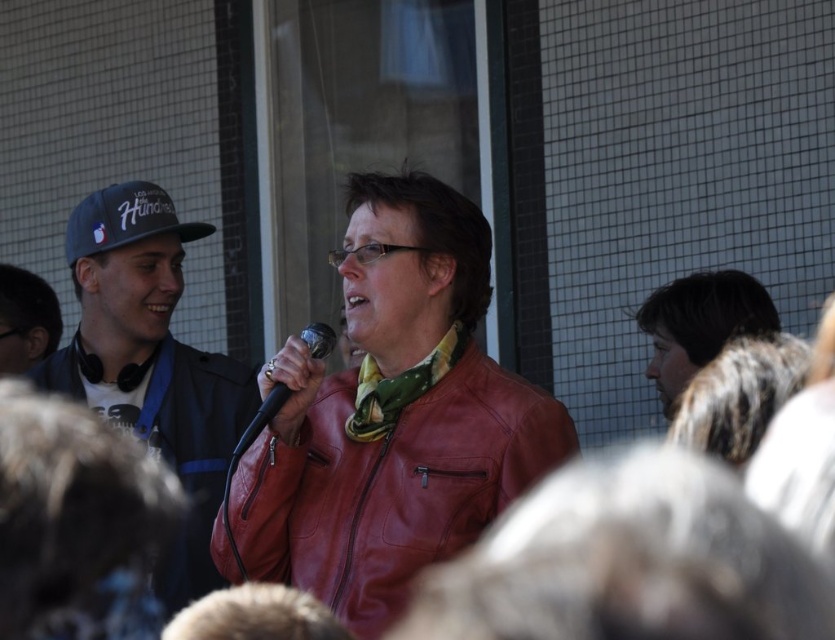
Is matte red leather jacket at center in front of matte black cap at left?

Yes, it is.

Is matte red leather jacket at center behind matte black cap at left?

That is False.

Is point (474, 435) less distant than point (191, 410)?

Yes, it is in front of point (191, 410).

You are a GUI agent. You are given a task and a screenshot of the screen. Output one action in this format:
    pyautogui.click(x=<x>, y=<y>)
    Task: Click on the matte red leather jacket at center
    This screenshot has width=835, height=640.
    Given the screenshot: What is the action you would take?
    pyautogui.click(x=391, y=484)

Can you confirm if matte red leather jacket at center is smaller than blue fabric baseball cap at left?

No, matte red leather jacket at center is not smaller than blue fabric baseball cap at left.

How far apart are matte red leather jacket at center and blue fabric baseball cap at left?

matte red leather jacket at center is 6.02 meters away from blue fabric baseball cap at left.

Is point (282, 486) less distant than point (198, 230)?

Yes, point (282, 486) is closer to viewer.

Identify the location of matte red leather jacket at center. (391, 484).

Is point (162, 308) more distant than point (125, 240)?

That is True.

Is point (158, 588) farther from camera compared to point (84, 214)?

No, it is in front of (84, 214).

This screenshot has height=640, width=835. I want to click on matte black cap at left, so click(x=150, y=362).